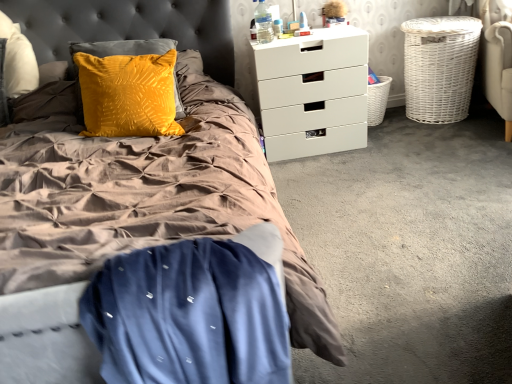
The width and height of the screenshot is (512, 384). What are the coordinates of `spots to the right of clear plastic water bottle at upper right` in the screenshot? It's located at (301, 38).